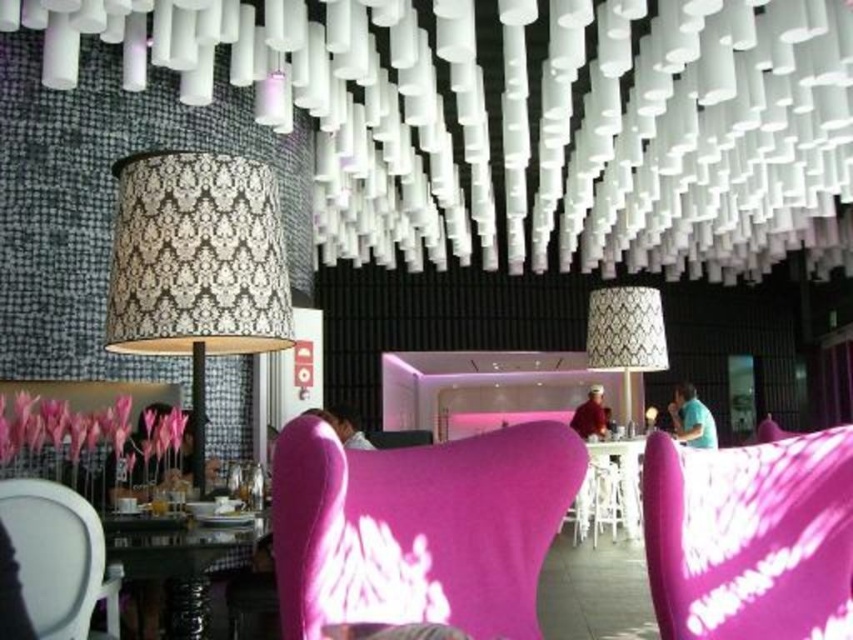
You are a customer in the modern cafe and want to sit in the matte pink fabric armchair at center. You see the patterned fabric lampshade at center nearby. Which side of the lampshade should you approach from to sit in the chair?

The matte pink fabric armchair at center is positioned on the left side of the patterned fabric lampshade at center, so you should approach from the left side of the lampshade to sit in the chair.

You are standing in the modern cafe and want to place a small plant between the two points marked as point (747, 456) and point (51, 536). Which point should the plant be closer to in order to be nearer to the viewer?

The plant should be placed closer to point (747, 456) because it is closer to the viewer than point (51, 536).

You are a customer in a modern cafe holding a tray with a teacup. You need to place the tray on the white fabric armchair at lower left or the glassy black table at lower left. Which surface is closer to your current position?

The white fabric armchair at lower left is 10.35 inches away from the glassy black table at lower left. Since you are holding the tray, you should choose the closer surface. However, without knowing your exact position, it is impossible to determine which is closer. Please clarify your location relative to both objects.